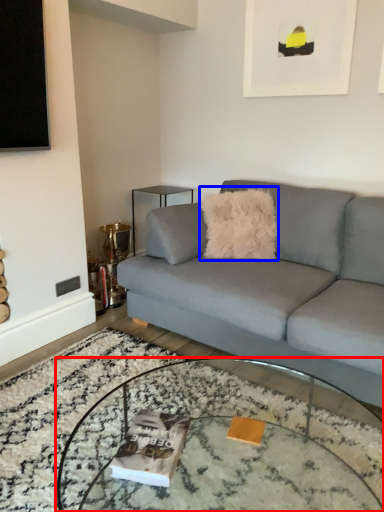
Question: Which of the following is the farthest to the observer, coffee table (highlighted by a red box) or throw pillow (highlighted by a blue box)?

Choices:
 (A) coffee table
 (B) throw pillow

Answer: (B)